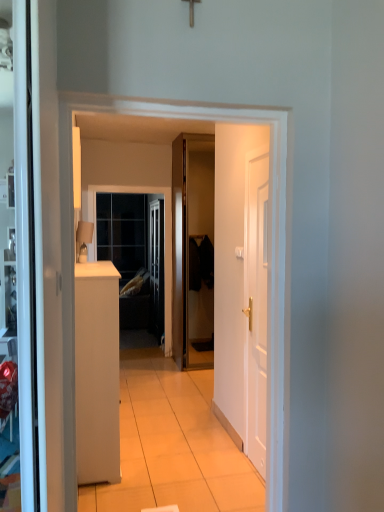
Question: Considering the relative positions of clear glass window at center and glossy wood door at center, the second door positioned from the front, in the image provided, is clear glass window at center to the left of glossy wood door at center, the second door positioned from the front, from the viewer's perspective?

Choices:
 (A) no
 (B) yes

Answer: (B)

Question: From a real-world perspective, is clear glass window at center physically above glossy wood door at center, the second door positioned from the front?

Choices:
 (A) yes
 (B) no

Answer: (B)

Question: Are clear glass window at center and glossy wood door at center, the second door from the right, beside each other?

Choices:
 (A) yes
 (B) no

Answer: (B)

Question: Does clear glass window at center have a lesser height compared to glossy wood door at center, the second door from the right?

Choices:
 (A) yes
 (B) no

Answer: (A)

Question: From a real-world perspective, is clear glass window at center under glossy wood door at center, the second door from the right?

Choices:
 (A) yes
 (B) no

Answer: (A)

Question: Would you say white matte cabinet at left is to the left or to the right of white matte door at right, the 2th door in the back-to-front sequence, in the picture?

Choices:
 (A) left
 (B) right

Answer: (A)

Question: Is white matte cabinet at left wider or thinner than white matte door at right, which appears as the second door when viewed from the left?

Choices:
 (A) wide
 (B) thin

Answer: (A)

Question: Considering the positions of white matte cabinet at left and white matte door at right, which appears as the second door when viewed from the left, in the image, is white matte cabinet at left taller or shorter than white matte door at right, which appears as the second door when viewed from the left,?

Choices:
 (A) tall
 (B) short

Answer: (B)

Question: From the image's perspective, is white matte cabinet at left located above or below white matte door at right, the 2th door in the back-to-front sequence?

Choices:
 (A) below
 (B) above

Answer: (A)

Question: From the image's perspective, is glossy wood door at center, marked as the 1th door in a left-to-right arrangement, above or below white matte door at right, marked as the 1th door in a front-to-back arrangement?

Choices:
 (A) below
 (B) above

Answer: (B)

Question: Looking at their shapes, would you say glossy wood door at center, the second door from the right, is wider or thinner than white matte door at right, which appears as the second door when viewed from the left?

Choices:
 (A) wide
 (B) thin

Answer: (A)

Question: Do you think glossy wood door at center, marked as the 1th door in a left-to-right arrangement, is within white matte door at right, which appears as the second door when viewed from the left, or outside of it?

Choices:
 (A) inside
 (B) outside

Answer: (B)

Question: Does point (185, 167) appear closer or farther from the camera than point (246, 203)?

Choices:
 (A) closer
 (B) farther

Answer: (B)

Question: Relative to clear glass window at center, is glossy wood door at center, the second door from the right, in front or behind?

Choices:
 (A) behind
 (B) front

Answer: (B)

Question: From a real-world perspective, is glossy wood door at center, marked as the 1th door in a left-to-right arrangement, above or below clear glass window at center?

Choices:
 (A) below
 (B) above

Answer: (B)